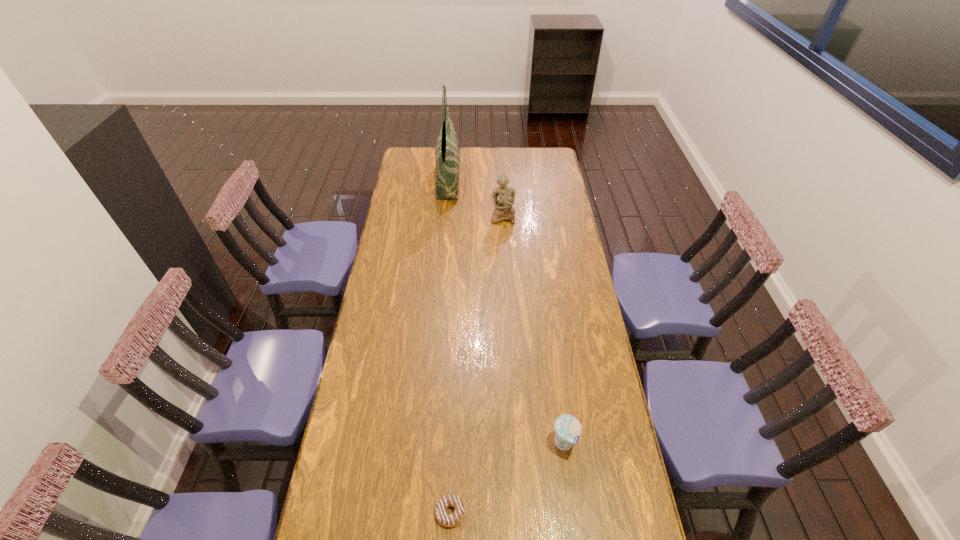
In order to click on free space between the doughnut and the second tallest object in this screenshot , I will do `click(476, 364)`.

Locate an element on the screen. The width and height of the screenshot is (960, 540). empty space that is in between the tote bag and the figurine is located at coordinates (475, 198).

The height and width of the screenshot is (540, 960). What are the coordinates of `unoccupied area between the nearest object and the second shortest object` in the screenshot? It's located at (507, 478).

This screenshot has width=960, height=540. I want to click on vacant space in between the doughnut and the rightmost object, so click(x=507, y=478).

Find the location of `unoccupied position between the tote bag and the nearest object`. unoccupied position between the tote bag and the nearest object is located at coordinates (449, 346).

Find the location of a particular element. This screenshot has width=960, height=540. free space between the third tallest object and the third nearest object is located at coordinates (533, 330).

Find the location of a particular element. free spot between the tallest object and the figurine is located at coordinates (475, 198).

At what (x,y) coordinates should I click in order to perform the action: click on vacant space that's between the nearest object and the yogurt. Please return your answer as a coordinate pair (x, y). The image size is (960, 540). Looking at the image, I should click on (507, 478).

This screenshot has width=960, height=540. I want to click on object that stands as the third closest to the farthest object, so click(445, 519).

Locate which object ranks second in proximity to the doughnut. Please provide its 2D coordinates. Your answer should be formatted as a tuple, i.e. [(x, y)], where the tuple contains the x and y coordinates of a point satisfying the conditions above.

[(504, 196)]